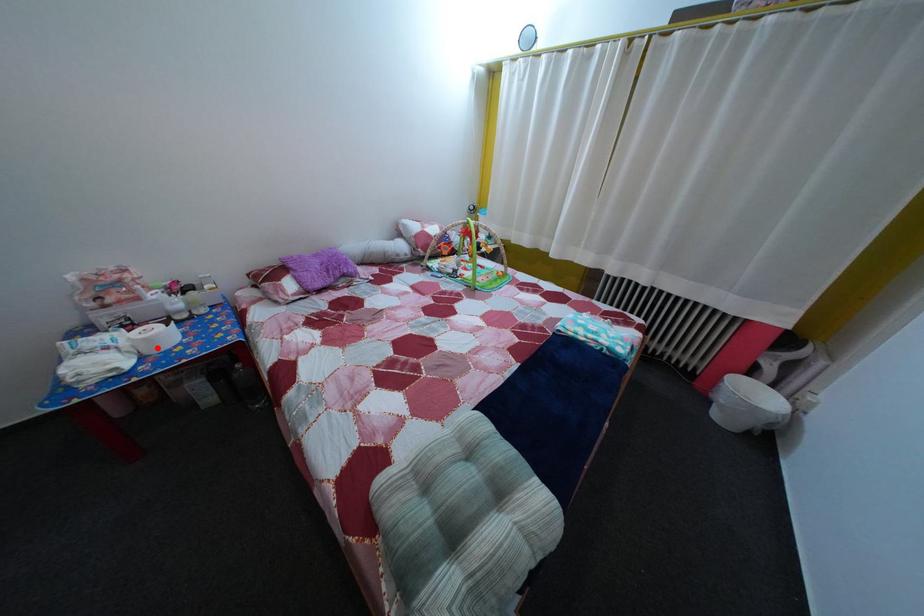
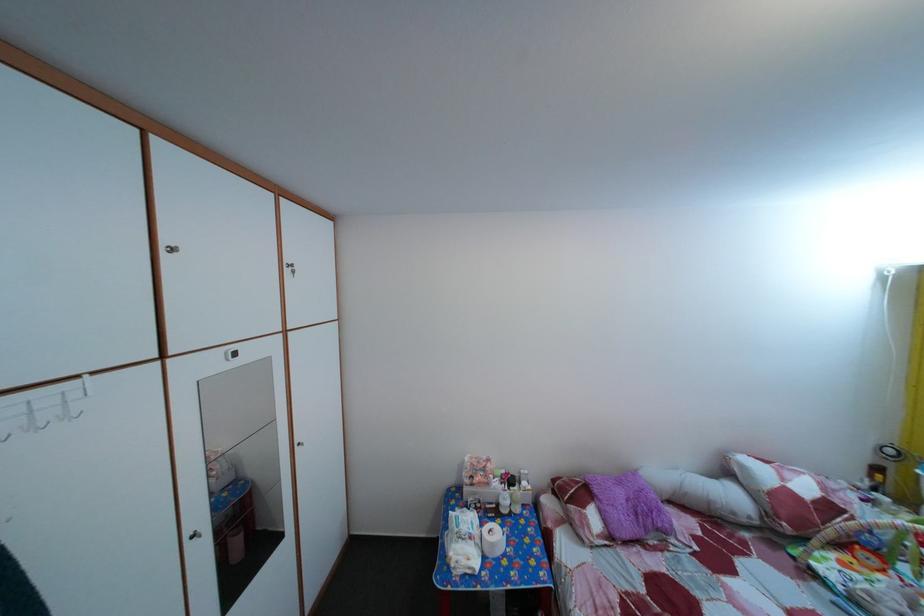
Locate, in the second image, the point that corresponds to the highlighted location in the first image.

(502, 553)